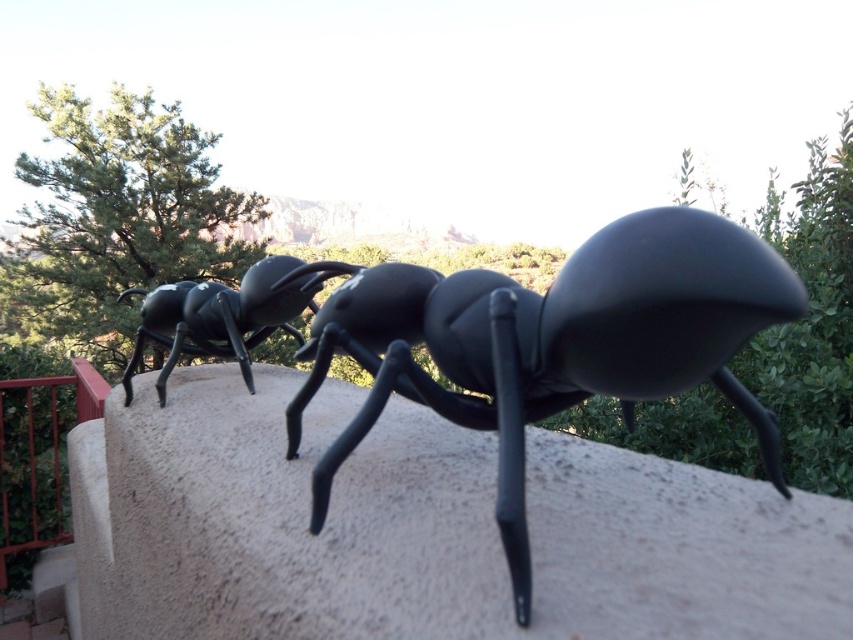
Question: Can you confirm if glossy black ant at center is bigger than matte black ant at center?

Choices:
 (A) no
 (B) yes

Answer: (B)

Question: Is glossy black ant at center to the right of matte black ant at center from the viewer's perspective?

Choices:
 (A) no
 (B) yes

Answer: (B)

Question: Does glossy black ant at center have a lesser width compared to matte black ant at center?

Choices:
 (A) yes
 (B) no

Answer: (B)

Question: Which point is closer to the camera?

Choices:
 (A) glossy black ant at center
 (B) matte black ant at center

Answer: (A)

Question: Which point is closer to the camera?

Choices:
 (A) (213, 352)
 (B) (648, 349)

Answer: (B)